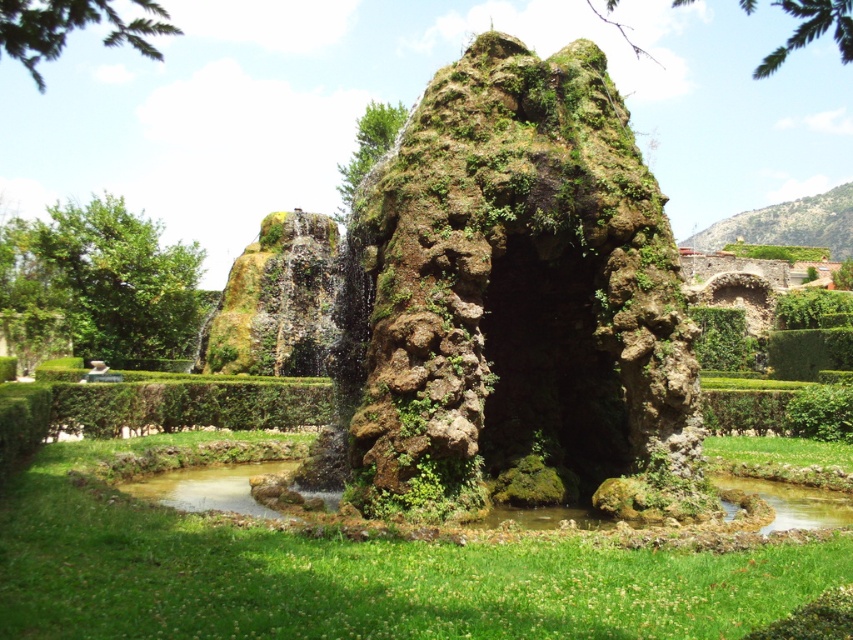
Does green mossy rock at center have a greater width compared to green grass at center?

No, green mossy rock at center is not wider than green grass at center.

Is green mossy rock at center above green grass at center?

Yes.

The image size is (853, 640). What do you see at coordinates (518, 300) in the screenshot? I see `green mossy rock at center` at bounding box center [518, 300].

This screenshot has height=640, width=853. In order to click on green mossy rock at center in this screenshot , I will do `click(518, 300)`.

From the picture: Does green mossy rock at center have a lesser width compared to green leafy tree at left?

Indeed, green mossy rock at center has a lesser width compared to green leafy tree at left.

Looking at this image, is green mossy rock at center in front of green leafy tree at left?

Yes.

Is point (434, 410) closer to camera compared to point (3, 269)?

Yes, point (434, 410) is closer to viewer.

Locate an element on the screen. The height and width of the screenshot is (640, 853). green mossy rock at center is located at coordinates 518,300.

Is green leafy tree at left positioned in front of green leafy tree at upper center?

No, green leafy tree at left is behind green leafy tree at upper center.

Between point (119, 275) and point (607, 8), which one is positioned behind?

The point (607, 8) is more distant.

What are the coordinates of `green leafy tree at left` in the screenshot? It's located at (97, 285).